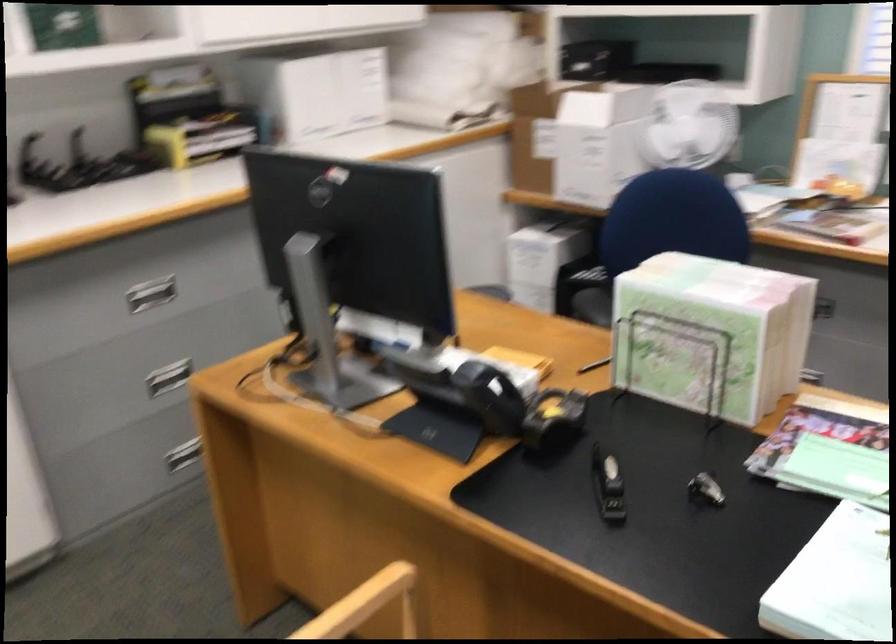
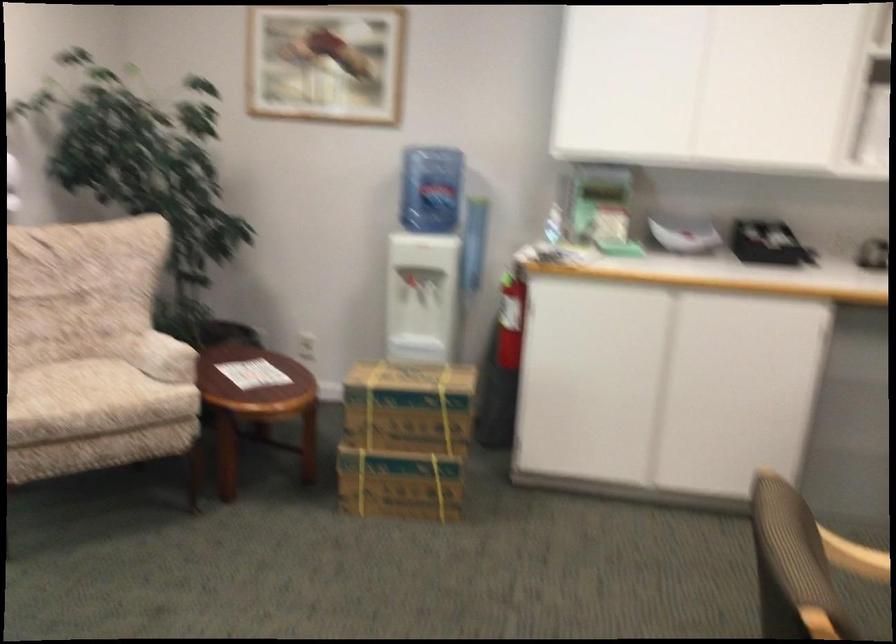
Locate, in the second image, the point that corresponds to pixel 149 527 in the first image.

(857, 529)